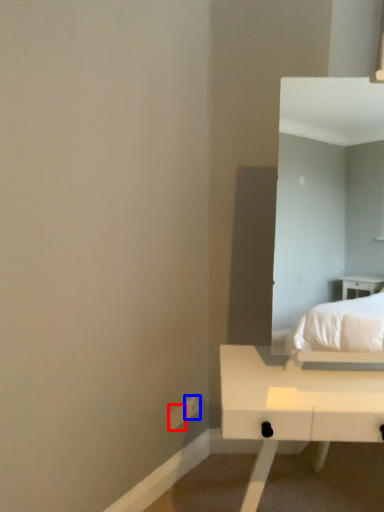
Question: Which object appears farthest to the camera in this image, electric outlet (highlighted by a red box) or electric outlet (highlighted by a blue box)?

Choices:
 (A) electric outlet
 (B) electric outlet

Answer: (B)